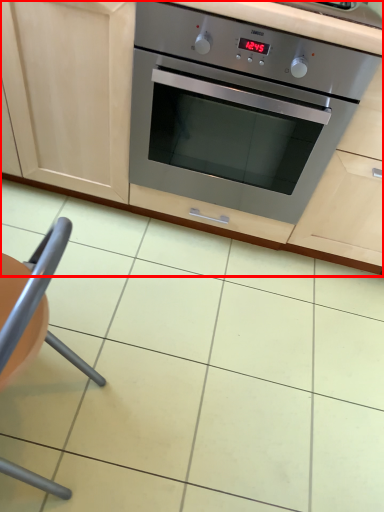
Question: From the image's perspective, where is cabinetry (annotated by the red box) located in relation to armchair in the image?

Choices:
 (A) below
 (B) above

Answer: (B)